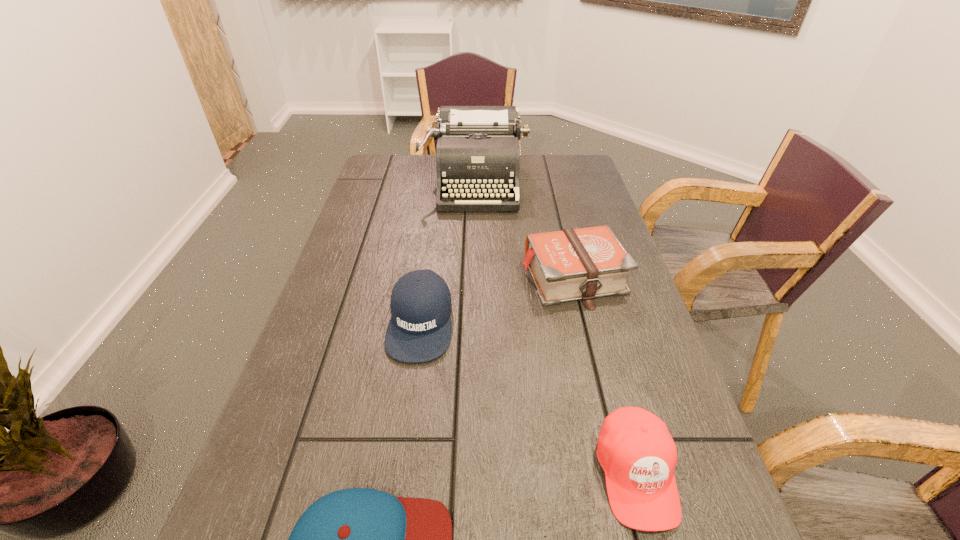
Locate an element on the screen. Image resolution: width=960 pixels, height=540 pixels. the farthest object is located at coordinates (477, 153).

Locate an element on the screen. Image resolution: width=960 pixels, height=540 pixels. the tallest object is located at coordinates (477, 153).

Locate an element on the screen. This screenshot has height=540, width=960. the farthest baseball cap is located at coordinates (419, 330).

Image resolution: width=960 pixels, height=540 pixels. In order to click on the rightmost baseball cap in this screenshot , I will do `click(635, 449)`.

Find the location of a particular element. The width and height of the screenshot is (960, 540). Bible is located at coordinates tap(581, 264).

Find the location of a particular element. vacant space located on the front-facing side of the tallest object is located at coordinates (473, 263).

At what (x,y) coordinates should I click in order to perform the action: click on free space located 0.260m on the front-facing side of the farthest baseball cap. Please return your answer as a coordinate pair (x, y). The width and height of the screenshot is (960, 540). Looking at the image, I should click on (396, 498).

Where is `vacant space positioned 0.230m on the front of the Bible`? The image size is (960, 540). vacant space positioned 0.230m on the front of the Bible is located at coordinates (602, 397).

Locate an element on the screen. This screenshot has height=540, width=960. object positioned at the far edge is located at coordinates (477, 153).

In order to click on baseball cap located at the right edge in this screenshot , I will do `click(635, 449)`.